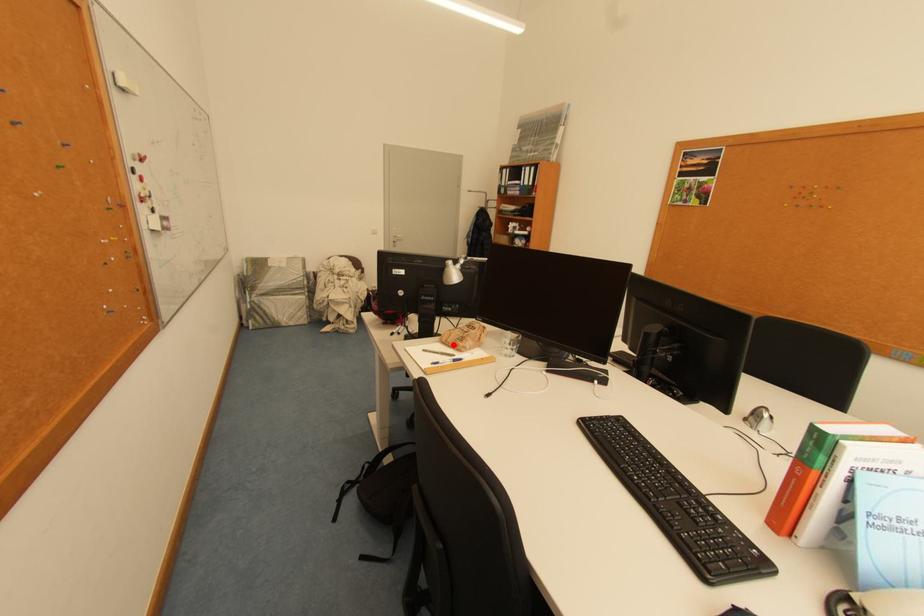
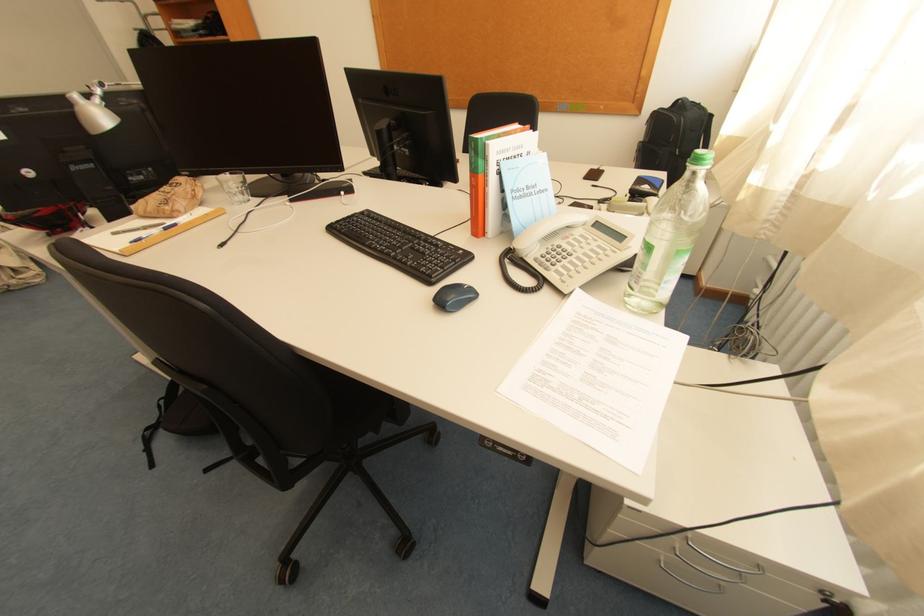
In the second image, find the point that corresponds to the highlighted location in the first image.

(155, 217)